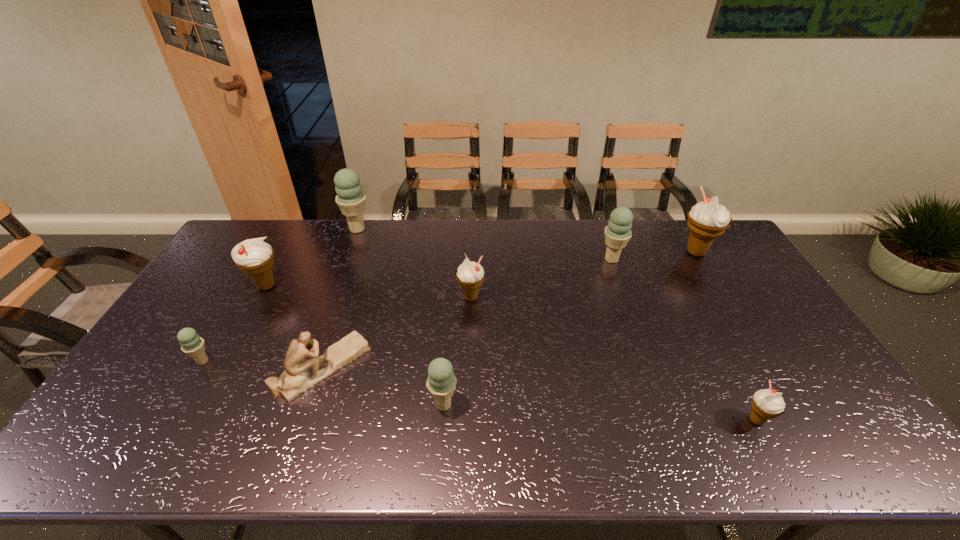
In order to click on vacant region located 0.290m on the back of the sixth farthest icecream in this screenshot , I will do `click(248, 285)`.

Find the location of a particular element. free location located 0.370m on the left of the nearest white icecream is located at coordinates (592, 420).

Where is `object located in the near edge section of the desktop`? The width and height of the screenshot is (960, 540). object located in the near edge section of the desktop is located at coordinates (767, 404).

You are a GUI agent. You are given a task and a screenshot of the screen. Output one action in this format:
    pyautogui.click(x=<x>, y=<y>)
    Task: Click on the object that is at the left edge
    
    Given the screenshot: What is the action you would take?
    pyautogui.click(x=192, y=344)

This screenshot has height=540, width=960. I want to click on object positioned at the right edge, so click(x=707, y=220).

You are a GUI agent. You are given a task and a screenshot of the screen. Output one action in this format:
    pyautogui.click(x=<x>, y=<y>)
    Task: Click on the object at the far right corner
    Image resolution: width=960 pixels, height=540 pixels.
    Given the screenshot: What is the action you would take?
    pyautogui.click(x=707, y=220)

Locate an element on the screen. The width and height of the screenshot is (960, 540). vacant space at the far edge is located at coordinates (373, 232).

Where is `free space at the near edge`? free space at the near edge is located at coordinates click(385, 457).

Where is `blank area at the left edge`? blank area at the left edge is located at coordinates (219, 260).

At what (x,y) coordinates should I click in order to perform the action: click on free point at the right edge. Please return your answer as a coordinate pair (x, y). This screenshot has width=960, height=540. Looking at the image, I should click on [809, 395].